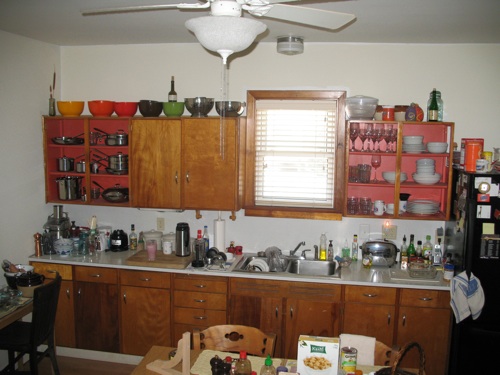
At what (x,y) coordinates should I click in order to perform the action: click on countertop. Please return your answer as a coordinate pair (x, y). Looking at the image, I should click on (97, 258), (113, 258), (360, 272).